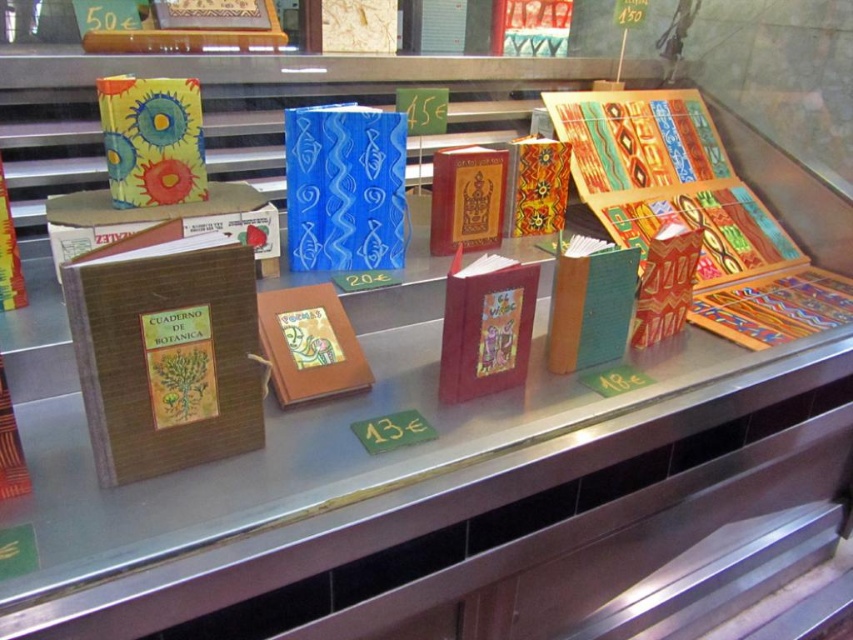
Does blue paper notebook at center appear over watercolor paper notebook at upper left?

No, blue paper notebook at center is not above watercolor paper notebook at upper left.

Does blue paper notebook at center appear under watercolor paper notebook at upper left?

Yes, blue paper notebook at center is below watercolor paper notebook at upper left.

The image size is (853, 640). What do you see at coordinates (344, 188) in the screenshot? I see `blue paper notebook at center` at bounding box center [344, 188].

You are a GUI agent. You are given a task and a screenshot of the screen. Output one action in this format:
    pyautogui.click(x=<x>, y=<y>)
    Task: Click on the blue paper notebook at center
    
    Given the screenshot: What is the action you would take?
    pyautogui.click(x=344, y=188)